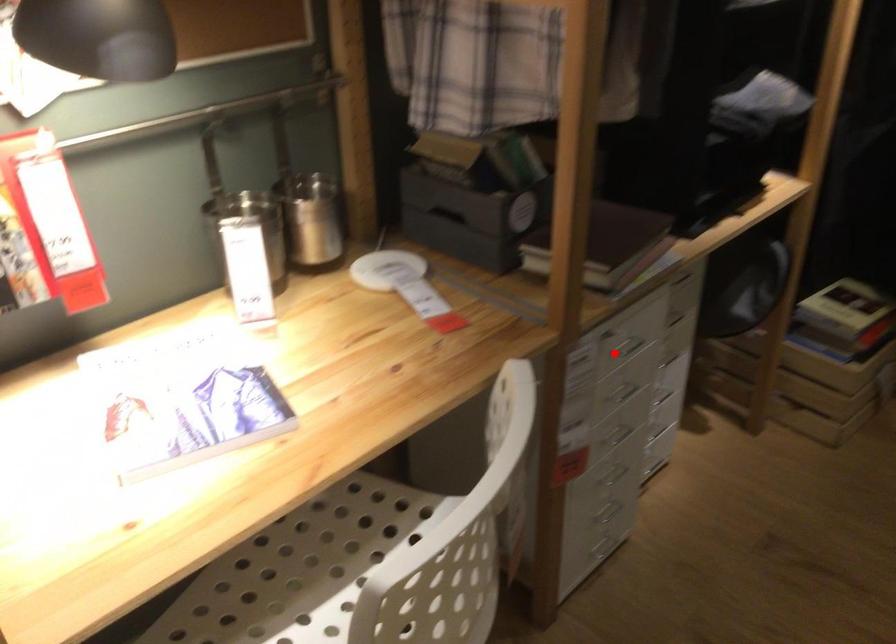
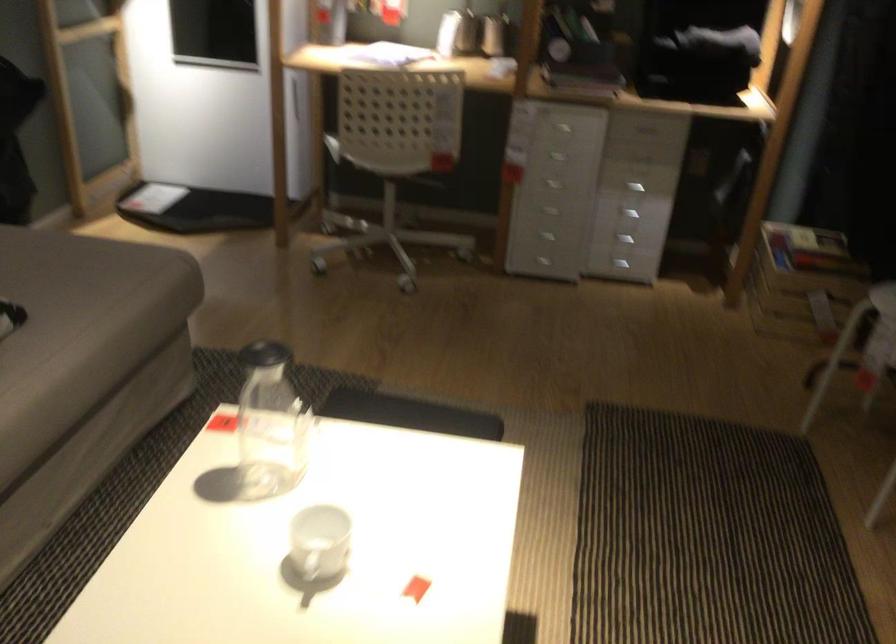
In the second image, find the point that corresponds to the highlighted location in the first image.

(563, 128)